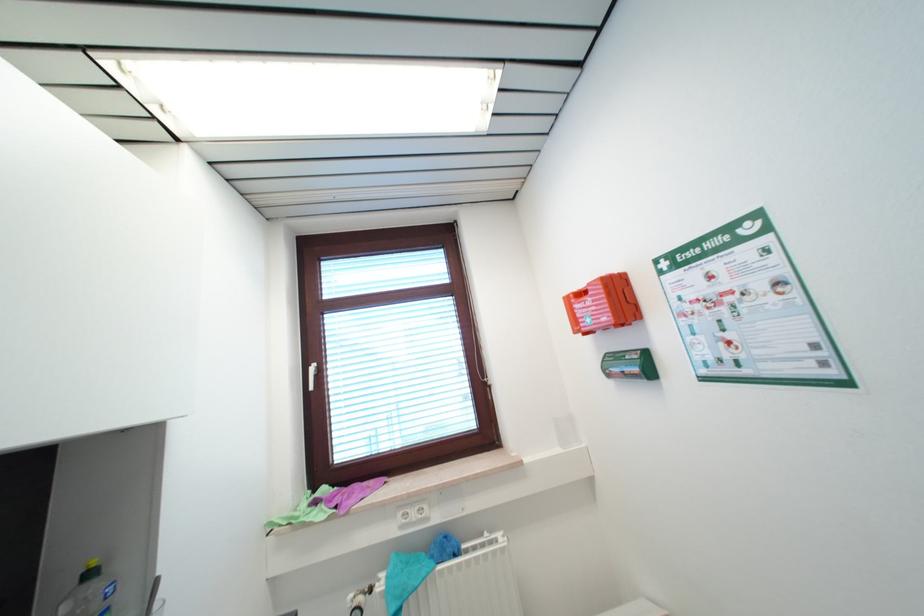
The location [602,304] corresponds to which object?

It corresponds to the red first-aid kit in the image.